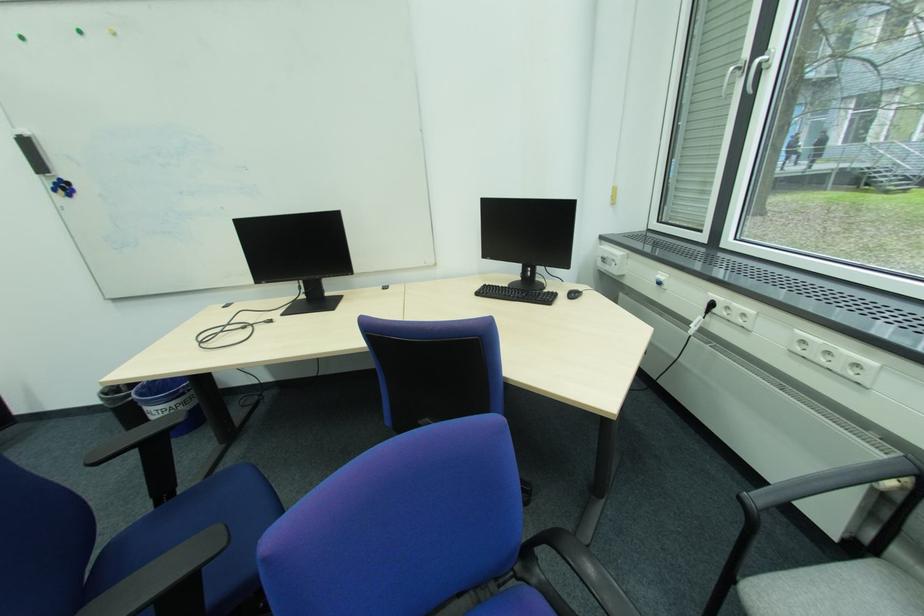
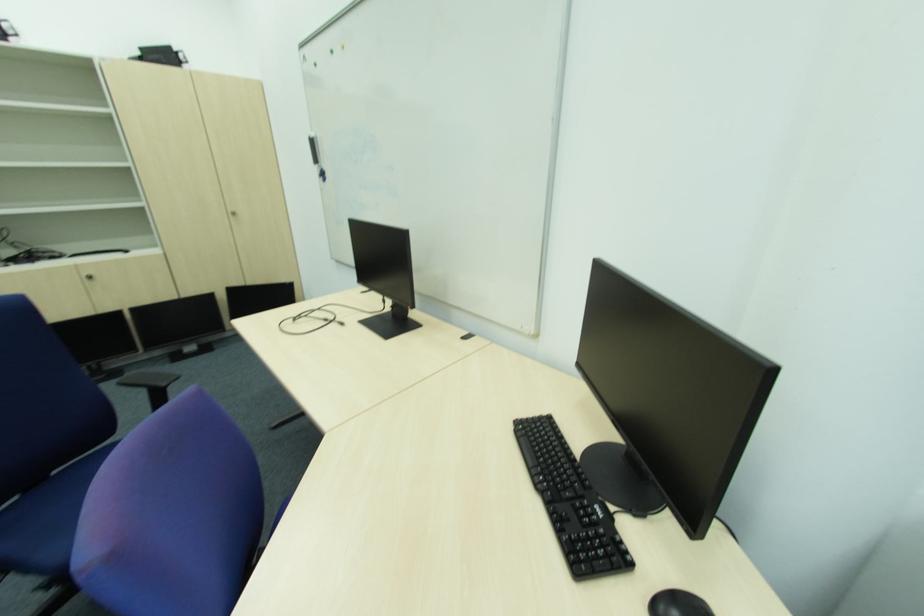
Question: I am providing you with two images of the same scene from different viewpoints. Which of the following objects are not visible in image2?

Choices:
 (A) black chair armrest
 (B) dispenser lock
 (C) whiteboard eraser
 (D) silver cabinet handle

Answer: (A)